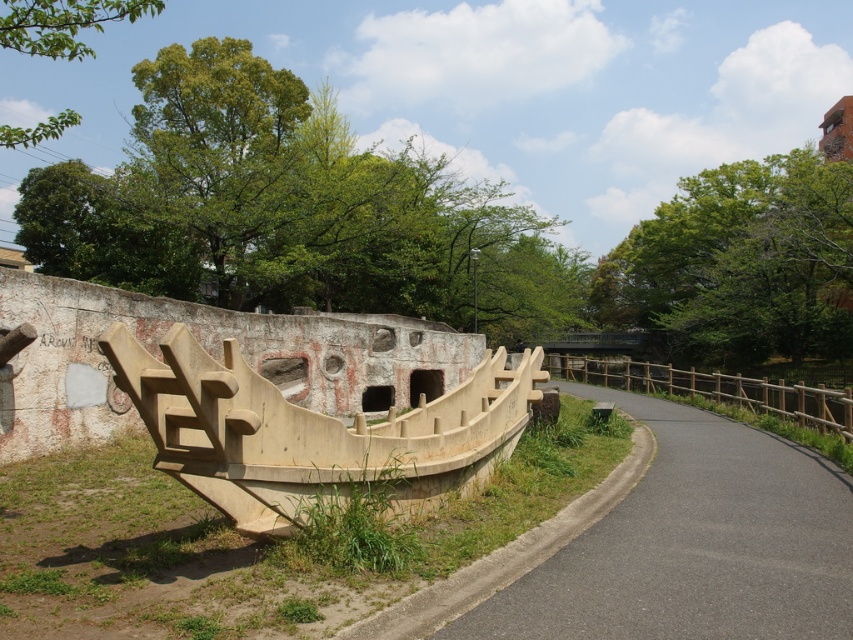
You are a delivery driver who needs to park your truck, which is 2 meters wide, along the asphalt road at center. Can you park your truck there without overlapping the beige concrete boat at center?

The asphalt road at center is wider than the beige concrete boat at center. However, since the beige concrete boat at center is located at the center of the road, parking a 2 meter wide truck there might still be possible if the road is sufficiently wide. However, without knowing the exact width of the road, it is difficult to determine if there is enough space. Please check the road width before deciding.

You are a delivery person carrying a package that requires a flat surface to place. You see the asphalt road at center and the beige concrete boat at center. Which surface would be more suitable for placing your package?

The asphalt road at center is more suitable for placing the package since it is a flat surface, whereas the beige concrete boat at center has angular, protruding elements that may make it uneven.